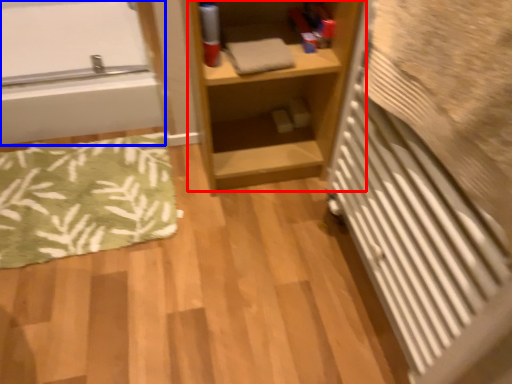
Question: Among these objects, which one is nearest to the camera, shelf (highlighted by a red box) or bathtub (highlighted by a blue box)?

Choices:
 (A) shelf
 (B) bathtub

Answer: (A)